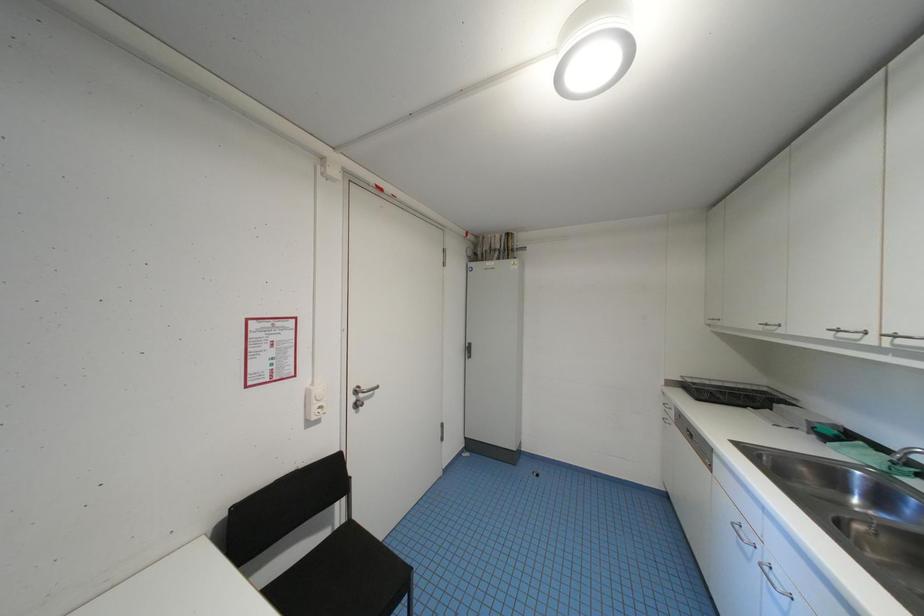
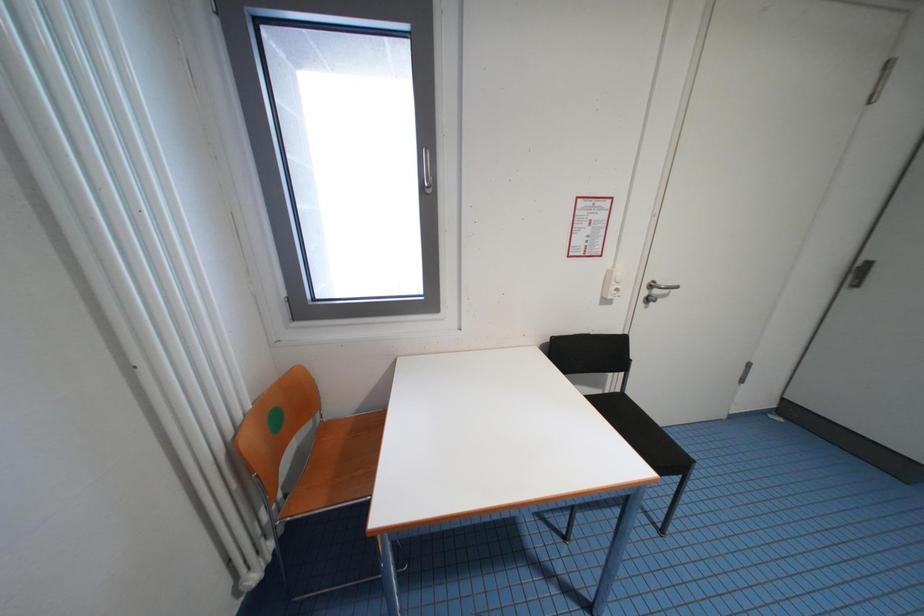
How did the camera likely rotate?

The camera rotated toward left-down.